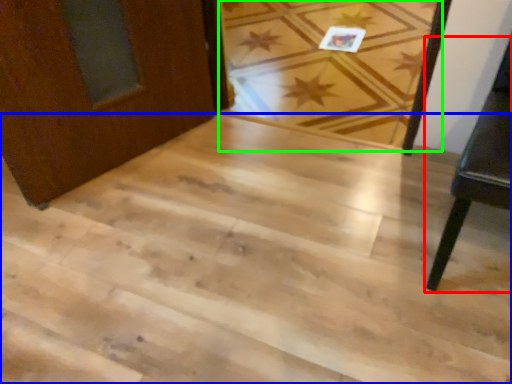
Question: Which is farther away from furniture (highlighted by a red box)? stairwell (highlighted by a blue box) or plank (highlighted by a green box)?

Choices:
 (A) stairwell
 (B) plank

Answer: (B)